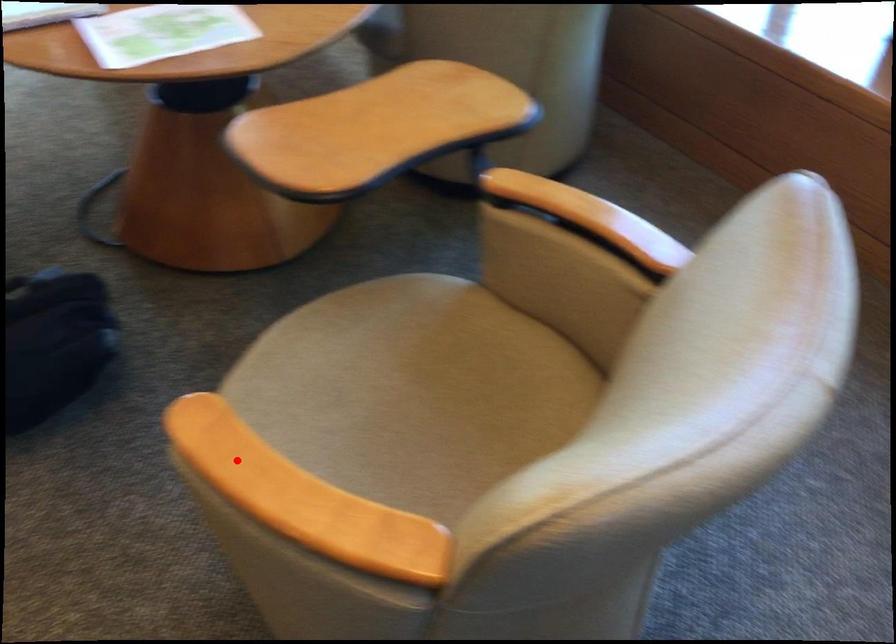
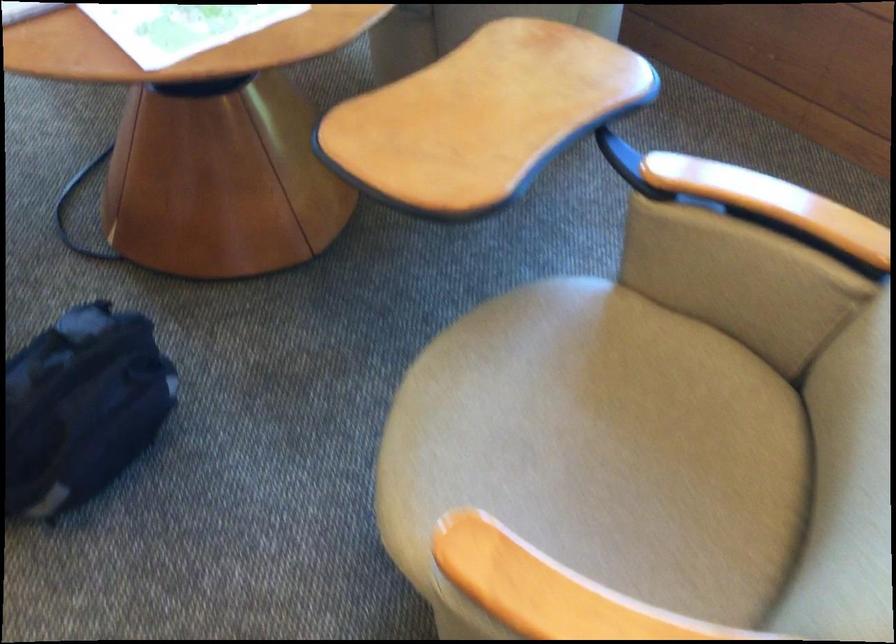
Question: A red point is marked in image1. In image2, is the corresponding 3D point closer to the camera or farther? Reply with the corresponding letter.

Choices:
 (A) The corresponding 3D point is closer.
 (B) The corresponding 3D point is farther.

Answer: (A)